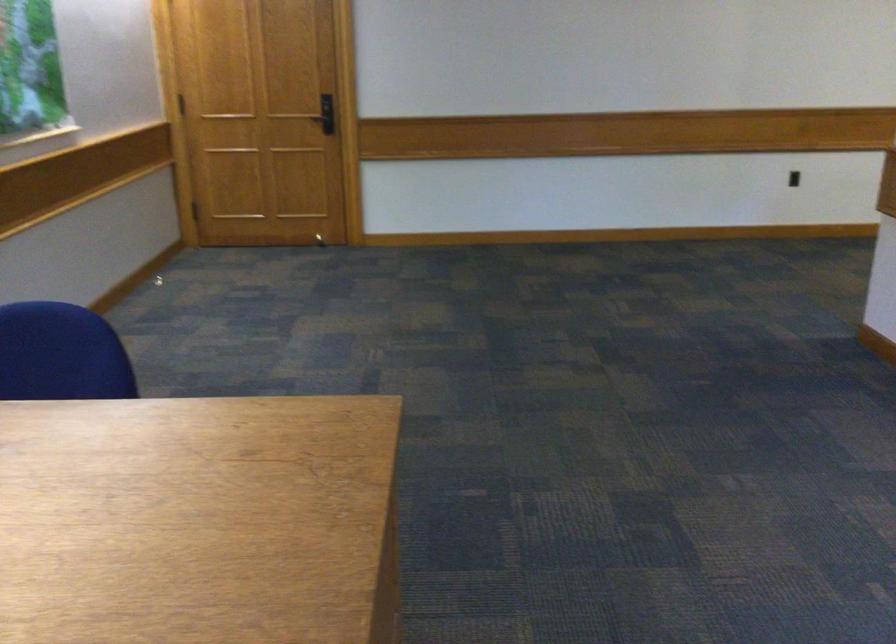
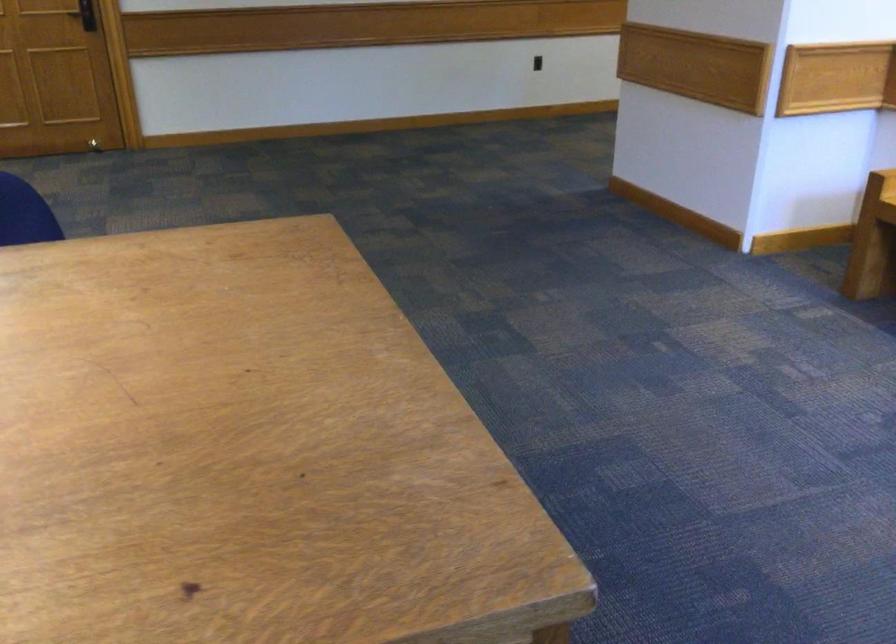
Question: The first image is from the beginning of the video and the second image is from the end. How did the camera likely rotate when shooting the video?

Choices:
 (A) Left
 (B) Right
 (C) Up
 (D) Down

Answer: (B)